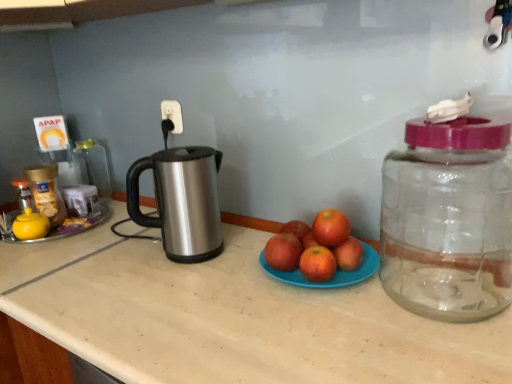
Locate an element on the screen. This screenshot has width=512, height=384. vacant area located to the right-hand side of gold plastic jar at left, acting as the 2th bottle starting from the front is located at coordinates (92, 222).